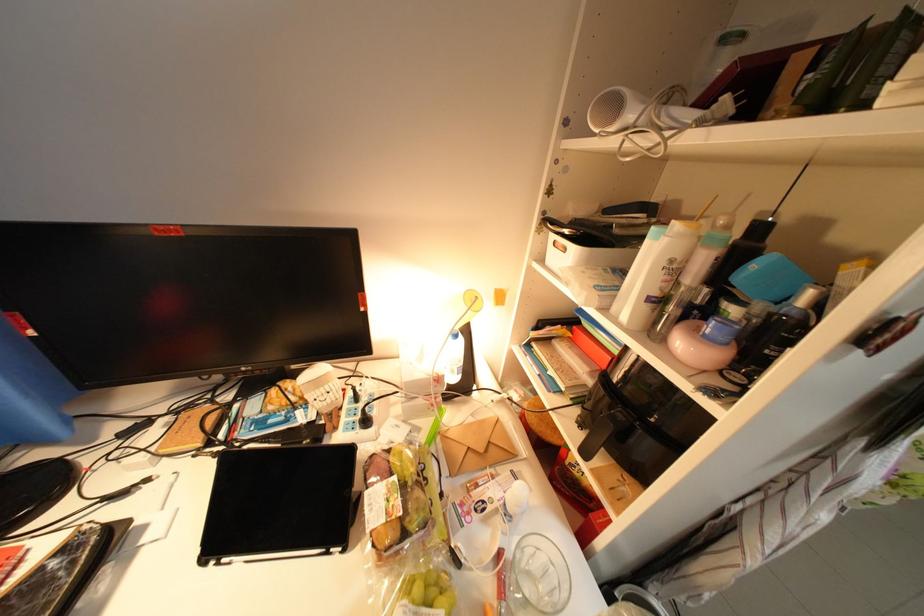
Locate an element on the screen. This screenshot has height=616, width=924. glass cup is located at coordinates (538, 578).